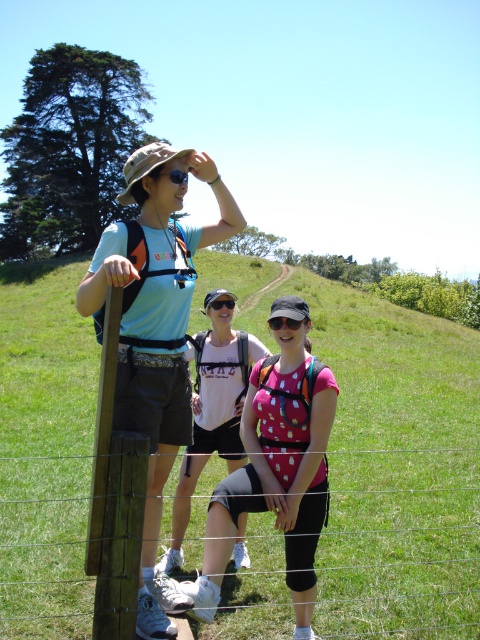
Question: Which object is closer to the camera taking this photo?

Choices:
 (A) black matte sunglasses at upper center
 (B) pink dotted shirt at center
 (C) transparent polka dot visor at center
 (D) white matte t-shirt at center

Answer: (B)

Question: Can you confirm if matte blue shirt at center is positioned to the right of white matte t-shirt at center?

Choices:
 (A) yes
 (B) no

Answer: (B)

Question: Does matte blue shirt at center have a smaller size compared to white matte t-shirt at center?

Choices:
 (A) no
 (B) yes

Answer: (A)

Question: Does transparent polka dot visor at center appear on the left side of black matte sunglasses at upper center?

Choices:
 (A) yes
 (B) no

Answer: (B)

Question: Which point is closer to the camera?

Choices:
 (A) (300, 320)
 (B) (290, 419)
 (C) (184, 493)

Answer: (B)

Question: Which of the following is the closest to the observer?

Choices:
 (A) matte blue shirt at center
 (B) transparent polka dot visor at center
 (C) black matte sunglasses at upper center

Answer: (A)